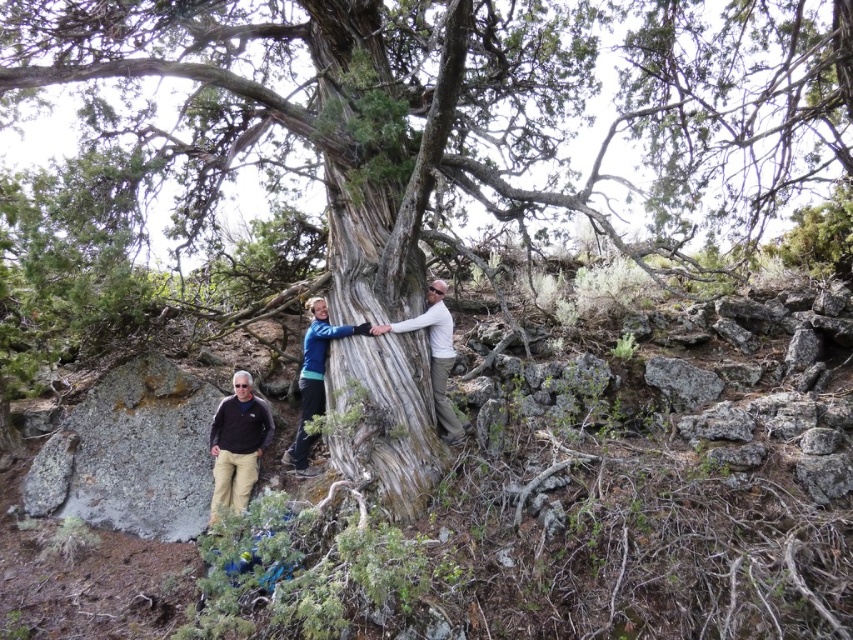
The width and height of the screenshot is (853, 640). What do you see at coordinates (236, 444) in the screenshot?
I see `dark brown sweater at center` at bounding box center [236, 444].

Is dark brown sweater at center taller than smooth skin hand at center?

Correct, dark brown sweater at center is much taller as smooth skin hand at center.

Locate an element on the screen. This screenshot has width=853, height=640. dark brown sweater at center is located at coordinates (236, 444).

Is gray textured tree trunk at center closer to the viewer compared to dark brown sweater at center?

Yes, gray textured tree trunk at center is closer to the viewer.

Based on the photo, can you confirm if gray textured tree trunk at center is positioned to the right of dark brown sweater at center?

Yes, gray textured tree trunk at center is to the right of dark brown sweater at center.

Does point (383, 196) come closer to viewer compared to point (248, 378)?

Yes, point (383, 196) is closer to viewer.

Locate an element on the screen. gray textured tree trunk at center is located at coordinates (376, 156).

Find the location of `gray textured tree trunk at center`. gray textured tree trunk at center is located at coordinates (376, 156).

What are the coordinates of `gray textured tree trunk at center` in the screenshot? It's located at (376, 156).

Find the location of a particular element. The image size is (853, 640). gray textured tree trunk at center is located at coordinates (376, 156).